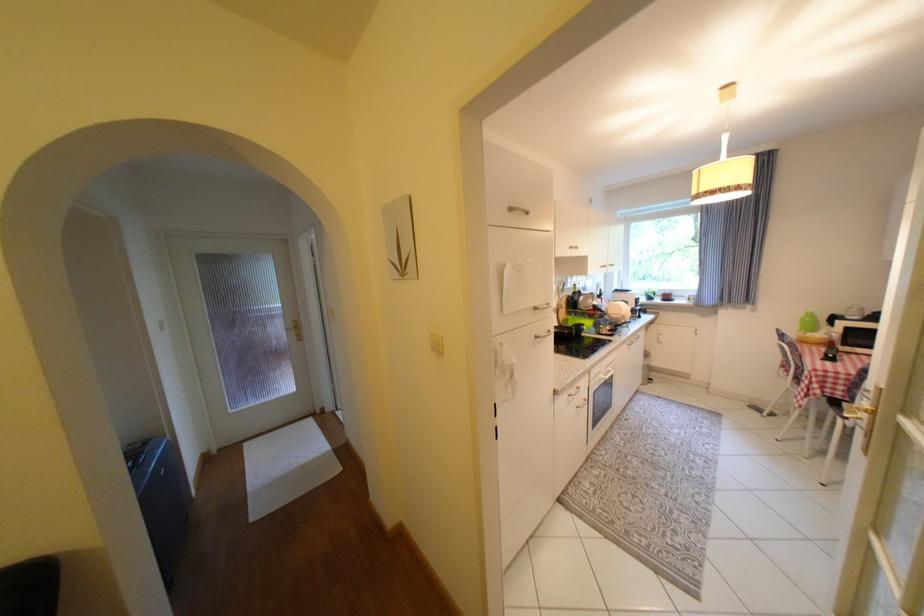
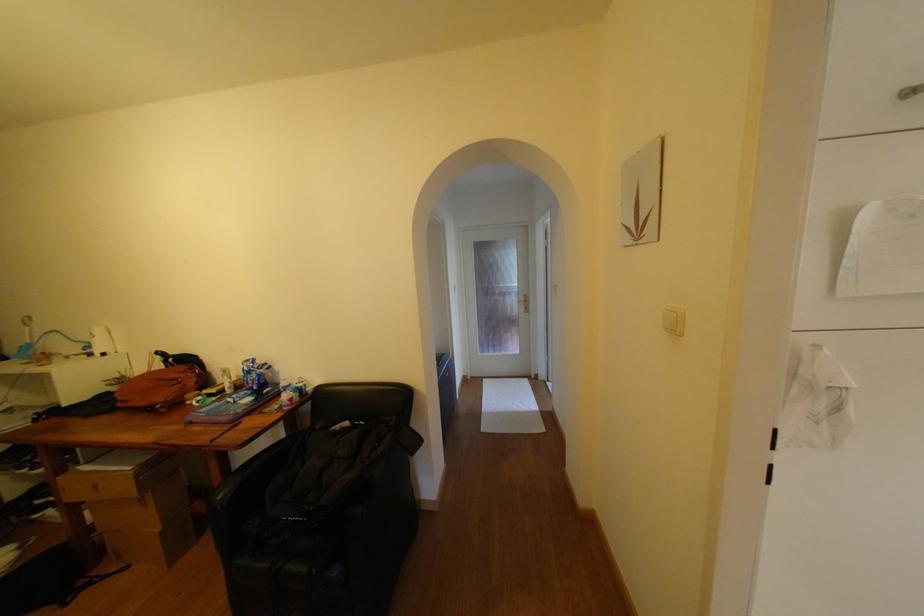
Question: How did the camera likely rotate?

Choices:
 (A) Left
 (B) Right
 (C) Up
 (D) Down

Answer: (A)